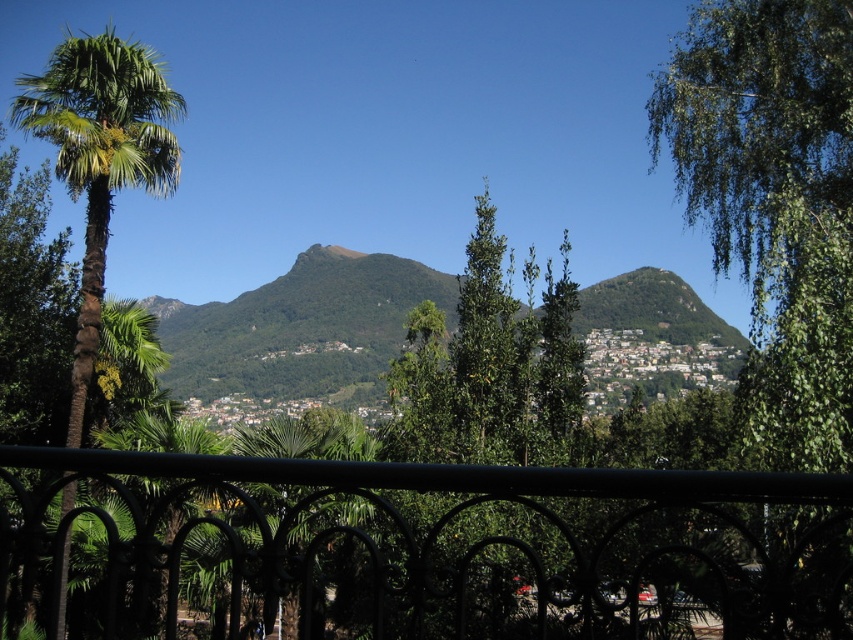
Question: Which point is farther to the camera?

Choices:
 (A) (837, 328)
 (B) (784, 627)
 (C) (78, 419)

Answer: (C)

Question: Which object appears closest to the camera in this image?

Choices:
 (A) black wrought iron fence at center
 (B) green leafy palm tree at left

Answer: (A)

Question: Is black wrought iron fence at center below green leafy tree at upper right?

Choices:
 (A) no
 (B) yes

Answer: (B)

Question: Which point appears closest to the camera in this image?

Choices:
 (A) (763, 193)
 (B) (766, 545)

Answer: (B)

Question: Does green leafy tree at upper right appear on the left side of green leafy palm tree at left?

Choices:
 (A) yes
 (B) no

Answer: (B)

Question: Can you confirm if black wrought iron fence at center is positioned above green leafy palm tree at left?

Choices:
 (A) no
 (B) yes

Answer: (A)